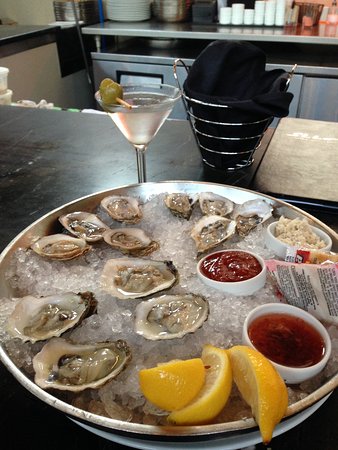
Locate an element on the screen. The height and width of the screenshot is (450, 338). tray is located at coordinates (206, 431).